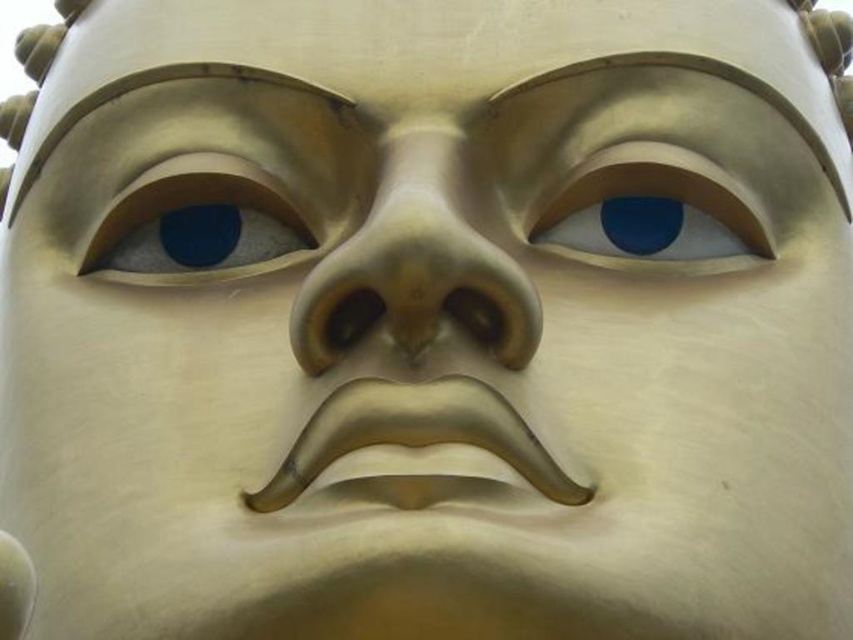
You are an art conservator examining the golden statue. You need to clean the gold metallic nose at center and the metallic gold eye at upper center. Which part should you clean first if you want to start from the higher position?

The metallic gold eye at upper center is higher than the gold metallic nose at center, so you should clean the metallic gold eye at upper center first.

You are an art conservator examining the golden statue. You notice two points on the statue, one at coordinates point [431,324] and another at point [144,202]. Which point is more prominent and closer to your view?

Point [431,324] is closer to the viewer than point [144,202], making it more prominent in the current perspective.

You are an art conservator examining the golden statue. You need to locate the gold metallic nose at center. Where exactly is it positioned in the image?

The gold metallic nose at center is located at point coordinates of 0.417 on the x axis and 0.489 on the y axis.